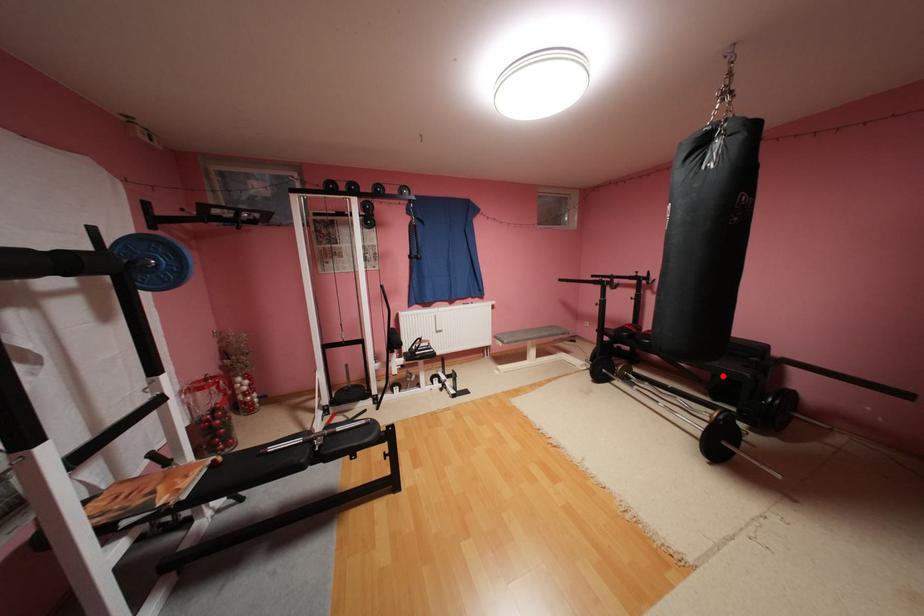
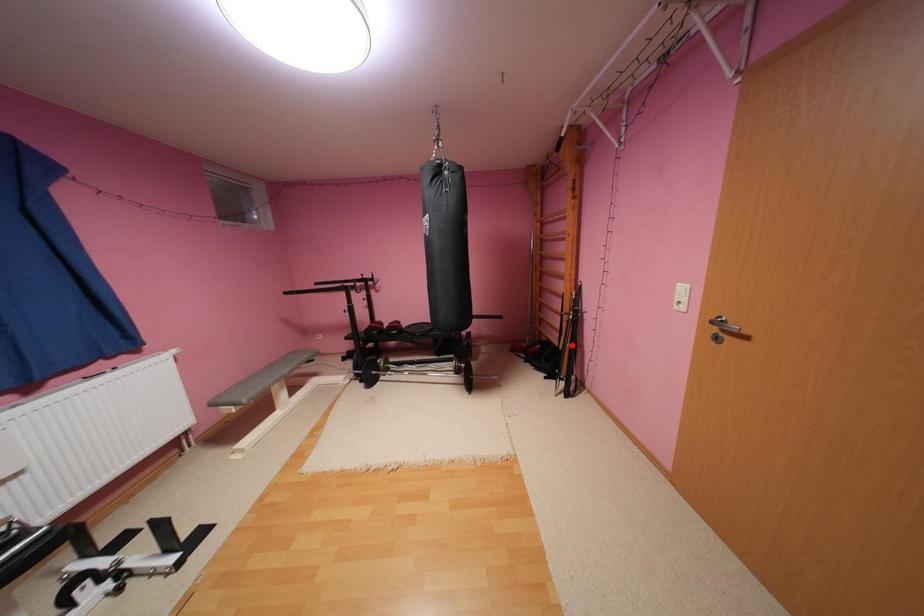
Consider the image. I am providing you with two images of the same scene from different viewpoints. A red point is marked on the first image and another point is marked on the second image. Are the points marked in image1 and image2 representing the same 3D position?

No